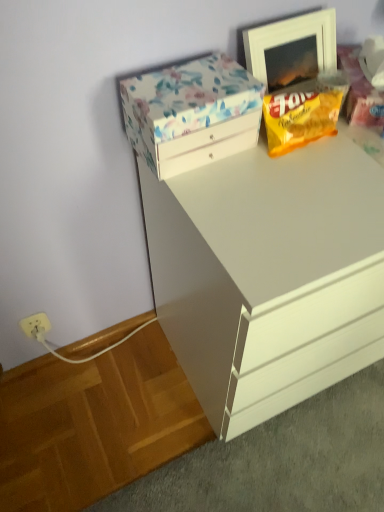
Identify the location of yellow matte snack packet at upper right. This screenshot has width=384, height=512. (304, 112).

Looking at this image, in order to face white glossy chest of drawers at upper center, should I rotate leftwards or rightwards?

Turn right approximately 16.515 degrees to face it.

Where is `white wooden picture frame at upper right`? The image size is (384, 512). white wooden picture frame at upper right is located at coordinates (291, 48).

From a real-world perspective, is yellow matte snack packet at upper right under white glossy chest of drawers at upper center?

No, from a real-world perspective, yellow matte snack packet at upper right is not beneath white glossy chest of drawers at upper center.

How many degrees apart are the facing directions of yellow matte snack packet at upper right and white glossy chest of drawers at upper center?

There is a 2.24-degree angle between the facing directions of yellow matte snack packet at upper right and white glossy chest of drawers at upper center.

Between yellow matte snack packet at upper right and white glossy chest of drawers at upper center, which one has smaller size?

yellow matte snack packet at upper right.

Based on the photo, do you think yellow matte snack packet at upper right is within white glossy chest of drawers at upper center, or outside of it?

yellow matte snack packet at upper right exists outside the volume of white glossy chest of drawers at upper center.

Is yellow matte snack packet at upper right turned away from floral-patterned cardboard box at upper left?

yellow matte snack packet at upper right does not have its back to floral-patterned cardboard box at upper left.

In the scene shown: What's the angular difference between yellow matte snack packet at upper right and floral-patterned cardboard box at upper left's facing directions?

The angular difference between yellow matte snack packet at upper right and floral-patterned cardboard box at upper left is 0.000417 degrees.

Looking at the image, does yellow matte snack packet at upper right seem bigger or smaller compared to floral-patterned cardboard box at upper left?

Considering their sizes, yellow matte snack packet at upper right takes up less space than floral-patterned cardboard box at upper left.

From the picture: From a real-world perspective, which object rests below the other?

floral-patterned cardboard box at upper left is physically lower.

Could you tell me if white wooden picture frame at upper right is turned towards floral-patterned cardboard box at upper left?

No, white wooden picture frame at upper right is not turned towards floral-patterned cardboard box at upper left.

From the image's perspective, is white wooden picture frame at upper right positioned above or below floral-patterned cardboard box at upper left?

Based on their image positions, white wooden picture frame at upper right is located above floral-patterned cardboard box at upper left.

Is point (198, 349) closer or farther from the camera than point (272, 109)?

Point (198, 349) is farther from the camera than point (272, 109).

Considering the sizes of white glossy chest of drawers at upper center and yellow matte snack packet at upper right in the image, is white glossy chest of drawers at upper center wider or thinner than yellow matte snack packet at upper right?

white glossy chest of drawers at upper center is wider than yellow matte snack packet at upper right.

Who is smaller, white glossy chest of drawers at upper center or yellow matte snack packet at upper right?

yellow matte snack packet at upper right is smaller.

Does white glossy chest of drawers at upper center contain yellow matte snack packet at upper right?

No.

Identify the location of chest of drawers located on the right of white wooden picture frame at upper right. (268, 275).

Is white wooden picture frame at upper right with white glossy chest of drawers at upper center?

white wooden picture frame at upper right is not next to white glossy chest of drawers at upper center, and they're not touching.

From the image's perspective, between white wooden picture frame at upper right and white glossy chest of drawers at upper center, which one is located above?

From the image's view, white wooden picture frame at upper right is above.

Is white wooden picture frame at upper right positioned behind white glossy chest of drawers at upper center?

Yes, the depth of white wooden picture frame at upper right is greater than that of white glossy chest of drawers at upper center.

Considering the positions of point (167, 79) and point (253, 53), is point (167, 79) closer or farther from the camera than point (253, 53)?

Point (167, 79) is positioned closer to the camera compared to point (253, 53).

Can you confirm if floral-patterned cardboard box at upper left is bigger than white wooden picture frame at upper right?

Correct, floral-patterned cardboard box at upper left is larger in size than white wooden picture frame at upper right.

Is white wooden picture frame at upper right surrounded by floral-patterned cardboard box at upper left?

Actually, white wooden picture frame at upper right is outside floral-patterned cardboard box at upper left.

From a real-world perspective, relative to white wooden picture frame at upper right, is floral-patterned cardboard box at upper left vertically above or below?

In terms of real-world spatial position, floral-patterned cardboard box at upper left is below white wooden picture frame at upper right.

Looking at this image, from the image's perspective, relative to white glossy chest of drawers at upper center, is floral-patterned cardboard box at upper left above or below?

floral-patterned cardboard box at upper left is situated higher than white glossy chest of drawers at upper center in the image.

Between floral-patterned cardboard box at upper left and white glossy chest of drawers at upper center, which one has less height?

floral-patterned cardboard box at upper left.

Does floral-patterned cardboard box at upper left appear on the left side of white glossy chest of drawers at upper center?

Yes.

Which of these two, floral-patterned cardboard box at upper left or white glossy chest of drawers at upper center, is thinner?

Thinner between the two is floral-patterned cardboard box at upper left.

Where is `the chest of drawers located underneath the yellow matte snack packet at upper right (from a real-world perspective)`? This screenshot has height=512, width=384. the chest of drawers located underneath the yellow matte snack packet at upper right (from a real-world perspective) is located at coordinates (268, 275).

You are a GUI agent. You are given a task and a screenshot of the screen. Output one action in this format:
    pyautogui.click(x=<x>, y=<y>)
    Task: Click on the storage box in front of the yellow matte snack packet at upper right
    Image resolution: width=384 pixels, height=512 pixels.
    Given the screenshot: What is the action you would take?
    pyautogui.click(x=192, y=113)

Estimate the real-world distances between objects in this image. Which object is further from white wooden picture frame at upper right, yellow matte snack packet at upper right or floral-patterned cardboard box at upper left?

The object further to white wooden picture frame at upper right is floral-patterned cardboard box at upper left.

Estimate the real-world distances between objects in this image. Which object is further from floral-patterned cardboard box at upper left, yellow matte snack packet at upper right or white wooden picture frame at upper right?

white wooden picture frame at upper right is positioned further to the anchor floral-patterned cardboard box at upper left.

When comparing their distances from white wooden picture frame at upper right, does floral-patterned cardboard box at upper left or yellow matte snack packet at upper right seem further?

Among the two, floral-patterned cardboard box at upper left is located further to white wooden picture frame at upper right.

In the scene shown: Estimate the real-world distances between objects in this image. Which object is closer to white glossy chest of drawers at upper center, floral-patterned cardboard box at upper left or yellow matte snack packet at upper right?

floral-patterned cardboard box at upper left is positioned closer to the anchor white glossy chest of drawers at upper center.

When comparing their distances from yellow matte snack packet at upper right, does floral-patterned cardboard box at upper left or white wooden picture frame at upper right seem further?

floral-patterned cardboard box at upper left is positioned further to the anchor yellow matte snack packet at upper right.

Considering their positions, is yellow matte snack packet at upper right positioned further to white glossy chest of drawers at upper center than floral-patterned cardboard box at upper left?

yellow matte snack packet at upper right is further to white glossy chest of drawers at upper center.

From the image, which object appears to be nearer to yellow matte snack packet at upper right, white wooden picture frame at upper right or white glossy chest of drawers at upper center?

The object closer to yellow matte snack packet at upper right is white wooden picture frame at upper right.

When comparing their distances from yellow matte snack packet at upper right, does white glossy chest of drawers at upper center or white wooden picture frame at upper right seem further?

white glossy chest of drawers at upper center is further to yellow matte snack packet at upper right.

The image size is (384, 512). In order to click on storage box that lies between white wooden picture frame at upper right and white glossy chest of drawers at upper center from top to bottom in this screenshot , I will do `click(192, 113)`.

Image resolution: width=384 pixels, height=512 pixels. In order to click on snack between floral-patterned cardboard box at upper left and white glossy chest of drawers at upper center from left to right in this screenshot , I will do `click(304, 112)`.

At what (x,y) coordinates should I click in order to perform the action: click on snack between white wooden picture frame at upper right and white glossy chest of drawers at upper center from top to bottom. Please return your answer as a coordinate pair (x, y). This screenshot has width=384, height=512. Looking at the image, I should click on (304, 112).

The height and width of the screenshot is (512, 384). I want to click on picture frame located between floral-patterned cardboard box at upper left and yellow matte snack packet at upper right in the left-right direction, so click(291, 48).